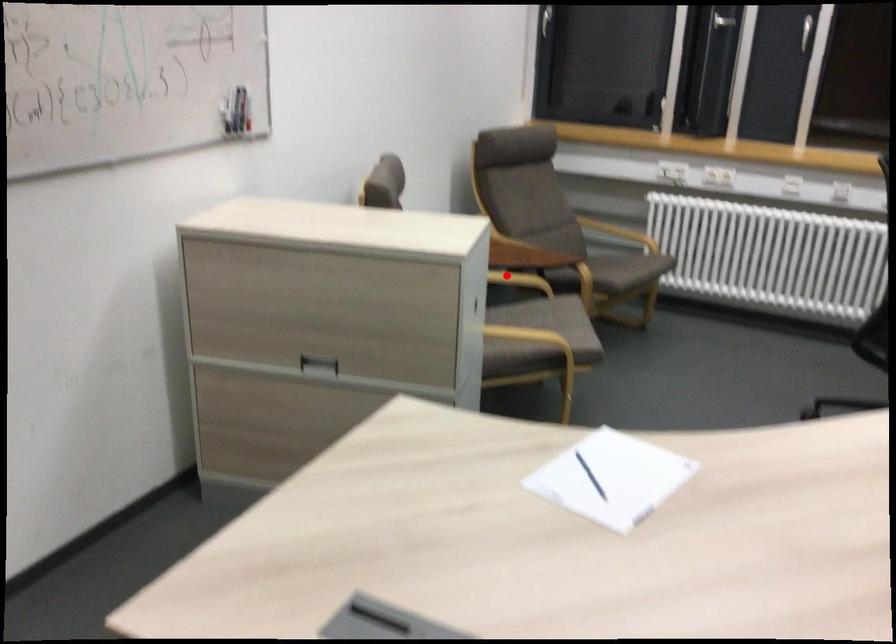
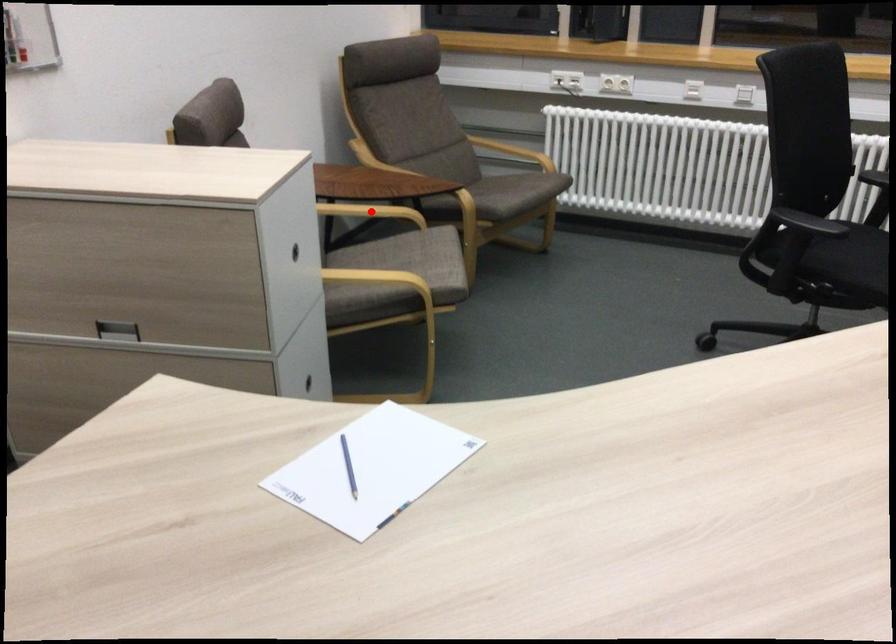
I am providing you with two images of the same scene from different viewpoints. A red point is marked on the first image and another point is marked on the second image. Are the points marked in image1 and image2 representing the same 3D position?

Yes